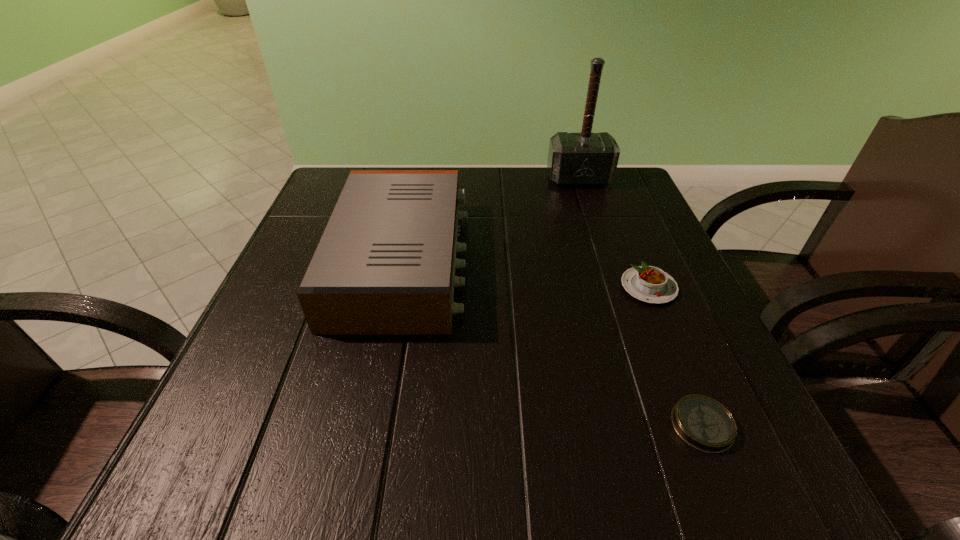
Where is `the farthest object`? The image size is (960, 540). the farthest object is located at coordinates click(574, 159).

Find the location of a particular element. This screenshot has height=540, width=960. the tallest object is located at coordinates (574, 159).

Find the location of a particular element. This screenshot has height=540, width=960. radio receiver is located at coordinates (385, 264).

The width and height of the screenshot is (960, 540). Find the location of `the third shortest object`. the third shortest object is located at coordinates pos(385,264).

Identify the location of pudding. The height and width of the screenshot is (540, 960). (650, 284).

This screenshot has width=960, height=540. I want to click on the nearest object, so click(703, 423).

Identify the location of compass. (703, 423).

What are the coordinates of `vacant space located on the left of the farthest object` in the screenshot? It's located at (455, 179).

Identify the location of vacant space located 0.060m on the control panel of the leftmost object. (495, 260).

The image size is (960, 540). In order to click on vacant space located 0.400m on the left of the second shortest object in this screenshot , I will do `click(412, 287)`.